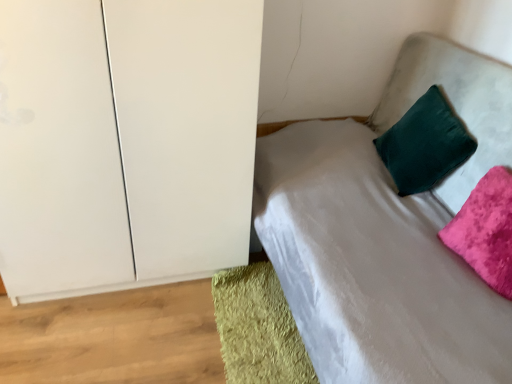
Question: Is green shaggy rug at lower left to the right of velvet green pillow at upper right, placed as the 1th pillow when sorted from back to front, from the viewer's perspective?

Choices:
 (A) yes
 (B) no

Answer: (B)

Question: Can you confirm if green shaggy rug at lower left is taller than velvet green pillow at upper right, placed as the 1th pillow when sorted from back to front?

Choices:
 (A) yes
 (B) no

Answer: (B)

Question: Is green shaggy rug at lower left turned away from velvet green pillow at upper right, placed as the 1th pillow when sorted from back to front?

Choices:
 (A) yes
 (B) no

Answer: (B)

Question: Can you confirm if green shaggy rug at lower left is positioned to the left of velvet green pillow at upper right, the second pillow positioned from the front?

Choices:
 (A) yes
 (B) no

Answer: (A)

Question: Is green shaggy rug at lower left positioned before velvet green pillow at upper right, placed as the 1th pillow when sorted from back to front?

Choices:
 (A) yes
 (B) no

Answer: (A)

Question: Is velvet green pillow at upper right, placed as the 1th pillow when sorted from back to front, in front of or behind velvet pink pillow at upper right, arranged as the first pillow when viewed from the front, in the image?

Choices:
 (A) front
 (B) behind

Answer: (B)

Question: Is velvet green pillow at upper right, placed as the 1th pillow when sorted from back to front, taller or shorter than velvet pink pillow at upper right, arranged as the first pillow when viewed from the front?

Choices:
 (A) short
 (B) tall

Answer: (B)

Question: From a real-world perspective, relative to velvet pink pillow at upper right, the 2th pillow viewed from the back, is velvet green pillow at upper right, placed as the 1th pillow when sorted from back to front, vertically above or below?

Choices:
 (A) below
 (B) above

Answer: (B)

Question: Visually, is velvet green pillow at upper right, the second pillow positioned from the front, positioned to the left or to the right of velvet pink pillow at upper right, arranged as the first pillow when viewed from the front?

Choices:
 (A) left
 (B) right

Answer: (A)

Question: Looking at the image, does velvet pink pillow at upper right, arranged as the first pillow when viewed from the front, seem bigger or smaller compared to green shaggy rug at lower left?

Choices:
 (A) big
 (B) small

Answer: (A)

Question: From the image's perspective, relative to green shaggy rug at lower left, is velvet pink pillow at upper right, the 2th pillow viewed from the back, above or below?

Choices:
 (A) above
 (B) below

Answer: (A)

Question: Would you say velvet pink pillow at upper right, the 2th pillow viewed from the back, is to the left or to the right of green shaggy rug at lower left in the picture?

Choices:
 (A) right
 (B) left

Answer: (A)

Question: Does point (496, 244) appear closer or farther from the camera than point (268, 319)?

Choices:
 (A) closer
 (B) farther

Answer: (A)

Question: From a real-world perspective, is green shaggy rug at lower left above or below velvet green pillow at upper right, the second pillow positioned from the front?

Choices:
 (A) above
 (B) below

Answer: (B)

Question: In terms of width, does green shaggy rug at lower left look wider or thinner when compared to velvet green pillow at upper right, placed as the 1th pillow when sorted from back to front?

Choices:
 (A) thin
 (B) wide

Answer: (B)